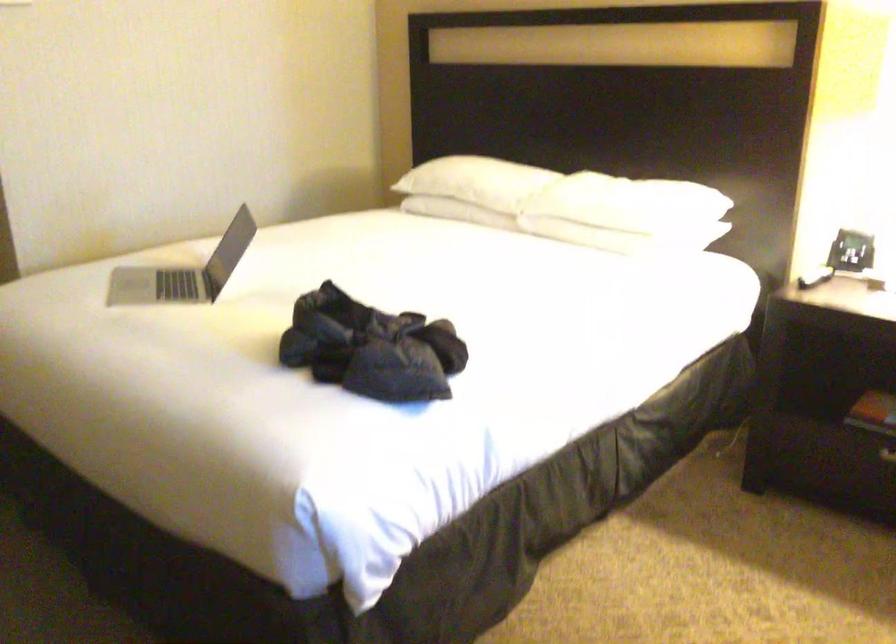
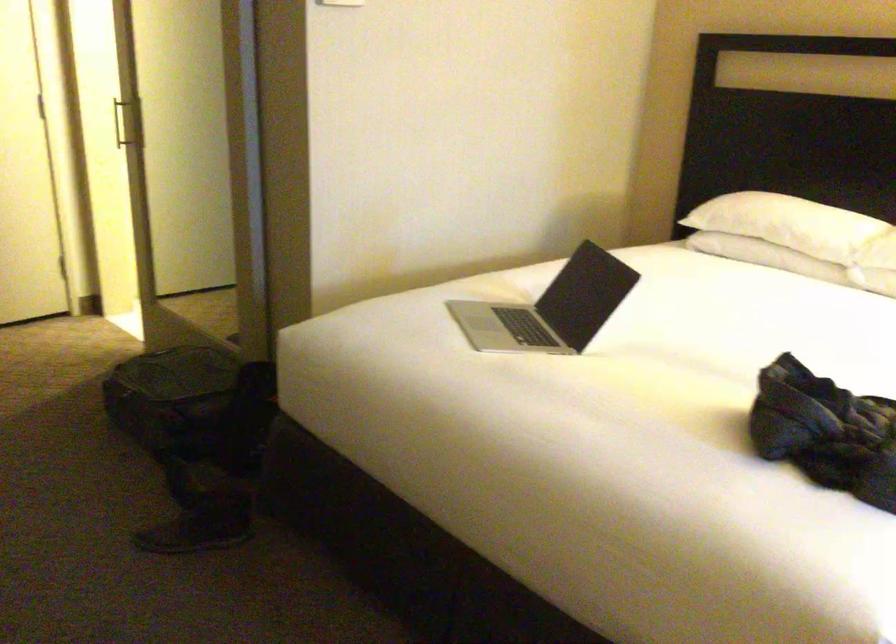
Question: The camera is either moving clockwise (left) or counter-clockwise (right) around the object. The first image is from the beginning of the video and the second image is from the end. Is the camera moving left or right when shooting the video?

Choices:
 (A) Left
 (B) Right

Answer: (B)